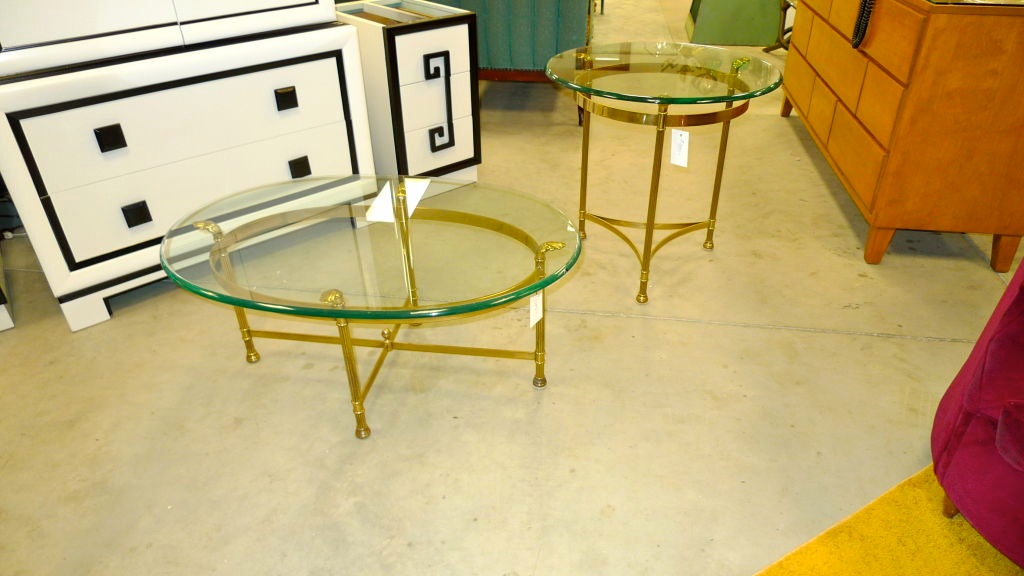
The height and width of the screenshot is (576, 1024). In order to click on side panel of dresser in this screenshot , I will do `click(981, 140)`.